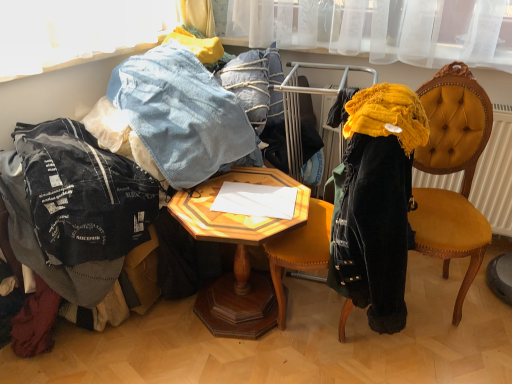
This screenshot has height=384, width=512. I want to click on free location in front of velvet yellow chair at right, so click(448, 355).